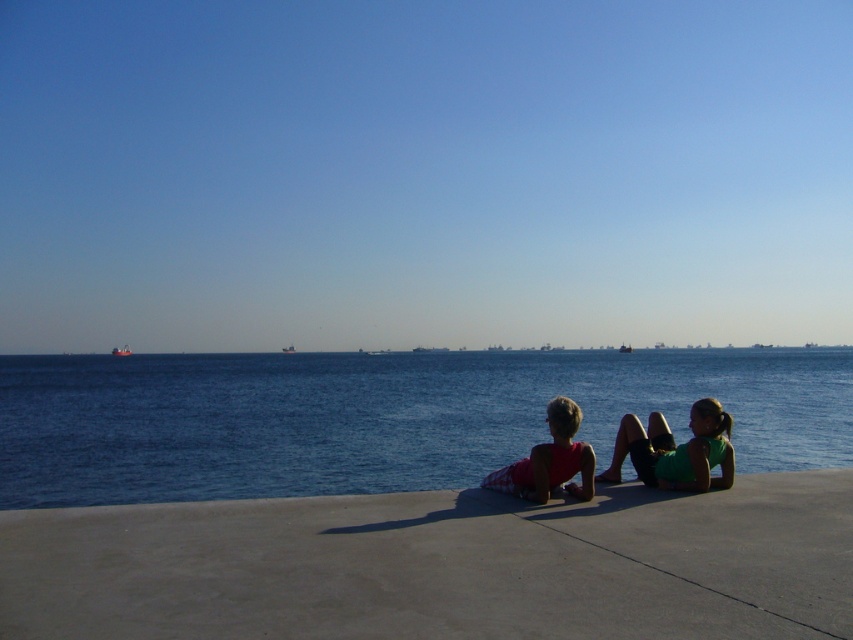
You are standing at the point marked as point (442, 564) in the image. Looking towards the two people sitting on the flat concrete surface, which direction should you walk to reach them?

The concretesmoothsolidconcrete at lower center is located at point (442, 564). Since the two people are sitting on the flat concrete surface facing away from the viewer towards the sea, you should walk forward from point (442, 564) to reach them.

You are a photographer trying to capture the perfect shot of the matte pink shorts at center and the matte pink tank top at center. Since you want to ensure both are clearly visible, which of these two items should you focus on to account for their size difference?

The matte pink shorts at center is wider than the matte pink tank top at center, so focusing on the matte pink shorts at center would better account for their size difference to ensure clarity.